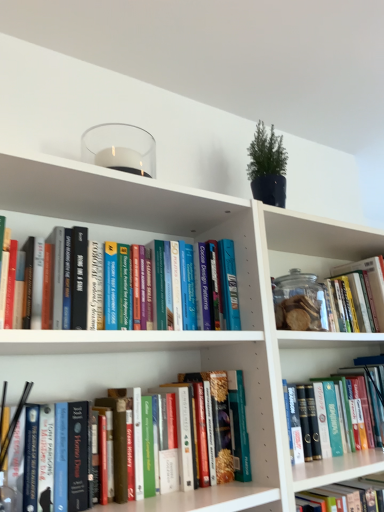
Question: Is the depth of white matte bookcase at upper center greater than that of transparent glass jar at center-right?

Choices:
 (A) yes
 (B) no

Answer: (B)

Question: Is white matte bookcase at upper center closer to the viewer compared to transparent glass jar at center-right?

Choices:
 (A) yes
 (B) no

Answer: (A)

Question: Is white matte bookcase at upper center surrounding transparent glass jar at center-right?

Choices:
 (A) yes
 (B) no

Answer: (A)

Question: Considering the relative sizes of white matte bookcase at upper center and transparent glass jar at center-right in the image provided, is white matte bookcase at upper center thinner than transparent glass jar at center-right?

Choices:
 (A) yes
 (B) no

Answer: (B)

Question: Is white matte bookcase at upper center at the right side of transparent glass jar at center-right?

Choices:
 (A) yes
 (B) no

Answer: (B)

Question: From a real-world perspective, is hardcover book at center, which is counted as the 4th book, starting from the top, physically located above or below hardcover books at center, which is the fifth book from bottom to top?

Choices:
 (A) above
 (B) below

Answer: (B)

Question: Does point (311, 354) appear closer or farther from the camera than point (125, 230)?

Choices:
 (A) closer
 (B) farther

Answer: (B)

Question: Looking at their shapes, would you say hardcover book at center, which is counted as the 4th book, starting from the top, is wider or thinner than hardcover books at center, which is the fifth book from bottom to top?

Choices:
 (A) wide
 (B) thin

Answer: (A)

Question: From the image's perspective, relative to hardcover books at center, which is the fifth book from bottom to top, is hardcover book at center, which is counted as the 4th book, starting from the top, above or below?

Choices:
 (A) below
 (B) above

Answer: (A)

Question: Is point (324, 500) closer or farther from the camera than point (236, 506)?

Choices:
 (A) closer
 (B) farther

Answer: (B)

Question: Looking at the image, does hardcover book at lower right, arranged as the 1th book when ordered from the bottom, seem bigger or smaller compared to hardcover book at center, placed as the third book when sorted from bottom to top?

Choices:
 (A) small
 (B) big

Answer: (A)

Question: Considering the relative positions of hardcover book at lower right, which appears as the fifth book when viewed from the top, and hardcover book at center, which ranks as the third book in top-to-bottom order, in the image provided, is hardcover book at lower right, which appears as the fifth book when viewed from the top, to the left or to the right of hardcover book at center, which ranks as the third book in top-to-bottom order,?

Choices:
 (A) right
 (B) left

Answer: (A)

Question: From the image's perspective, is hardcover book at lower right, arranged as the 1th book when ordered from the bottom, above or below hardcover book at center, which ranks as the third book in top-to-bottom order?

Choices:
 (A) above
 (B) below

Answer: (B)

Question: Visually, is white matte bookcase at upper center positioned to the left or to the right of hardcover book at lower right, which appears as the fifth book when viewed from the top?

Choices:
 (A) right
 (B) left

Answer: (B)

Question: Is point (266, 249) closer or farther from the camera than point (367, 478)?

Choices:
 (A) farther
 (B) closer

Answer: (B)